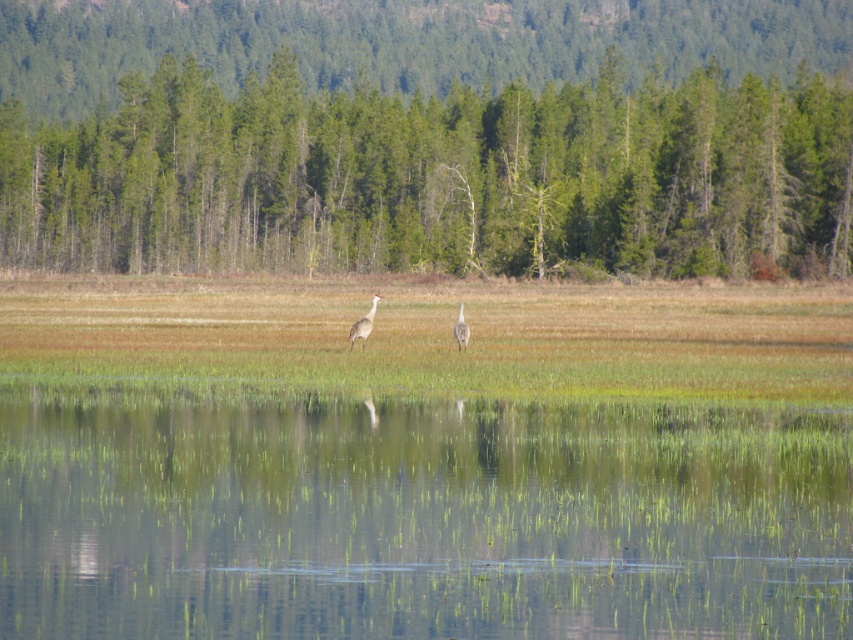
You are a photographer aiming to capture the reflection of the gray feathered bird at center in the clear water at center. Based on the scene, will the reflection of the bird be fully visible in the water?

The clear water at center is taller than the gray feathered bird at center, so the reflection of the gray feathered bird at center will be fully visible in the water since the water surface is high enough to mirror the entire bird.

You are standing at the edge of the marsh and see the point marked at coordinates point [428,138]. Based on the scene, what type of surface is this point located on?

The point [428,138] is on green matte trees at center.